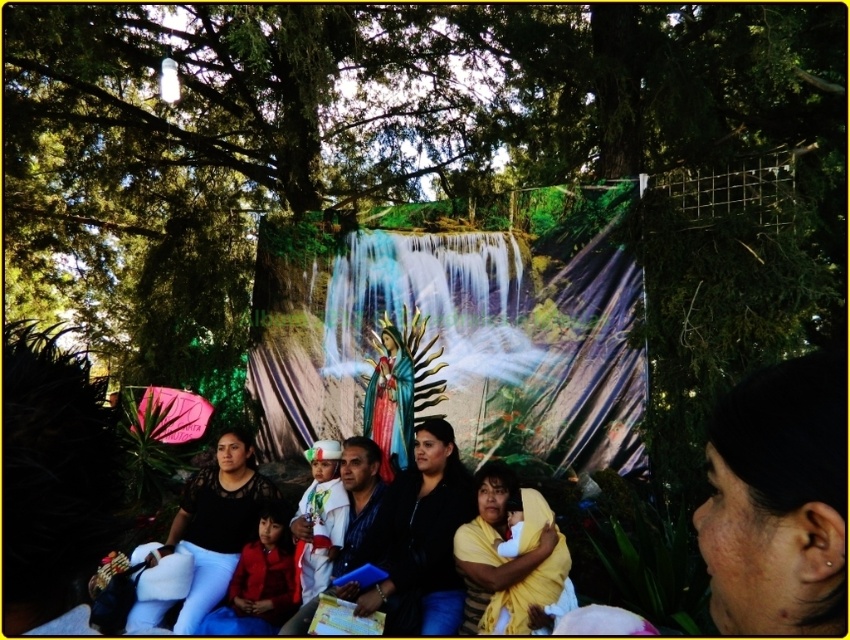
Consider the image. Does metallic blue water at center have a smaller size compared to white satin dress at center?

No.

Who is higher up, metallic blue water at center or white satin dress at center?

Positioned higher is metallic blue water at center.

Is point (434, 304) positioned behind point (335, 493)?

Yes, point (434, 304) is behind point (335, 493).

The width and height of the screenshot is (850, 640). In order to click on metallic blue water at center in this screenshot , I will do `click(432, 300)`.

Does point (383, 554) come behind point (516, 529)?

Yes, point (383, 554) is farther from viewer.

What are the coordinates of `matte black clothing at center` in the screenshot? It's located at (437, 536).

This screenshot has width=850, height=640. What are the coordinates of `matte black clothing at center` in the screenshot? It's located at (437, 536).

You are a GUI agent. You are given a task and a screenshot of the screen. Output one action in this format:
    pyautogui.click(x=<x>, y=<y>)
    Task: Click on the black matte dress at center
    The image size is (850, 640).
    Given the screenshot: What is the action you would take?
    pyautogui.click(x=218, y=522)

The height and width of the screenshot is (640, 850). Describe the element at coordinates (218, 522) in the screenshot. I see `black matte dress at center` at that location.

This screenshot has height=640, width=850. In order to click on black matte dress at center in this screenshot , I will do `click(218, 522)`.